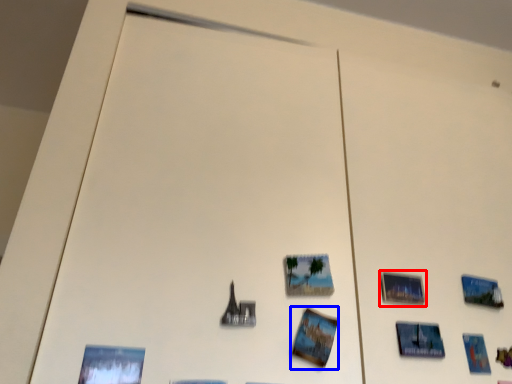
Question: Which of the following is the farthest to the observer, picture frame (highlighted by a red box) or postcard (highlighted by a blue box)?

Choices:
 (A) picture frame
 (B) postcard

Answer: (A)